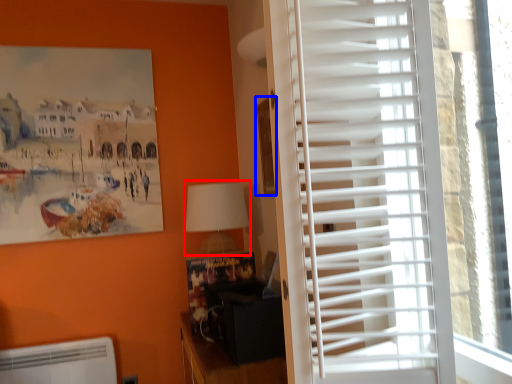
Question: Which object is closer to the camera taking this photo, table lamp (highlighted by a red box) or picture frame (highlighted by a blue box)?

Choices:
 (A) table lamp
 (B) picture frame

Answer: (B)